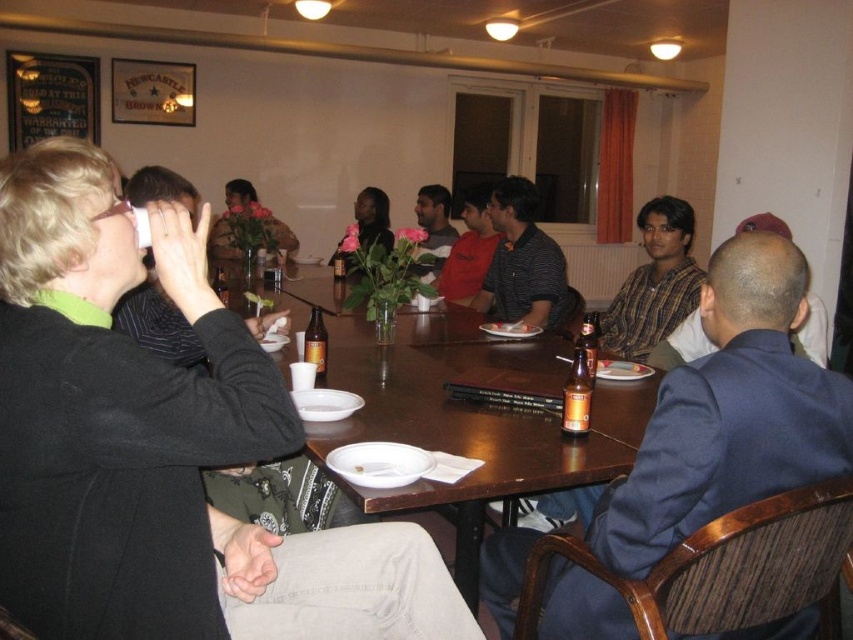
Question: From the image, what is the correct spatial relationship of dark blue suit at center in relation to matte black shirt at center?

Choices:
 (A) below
 (B) above

Answer: (A)

Question: Can you confirm if golden glass bottle at table center is wider than brown glass bottle at table center?

Choices:
 (A) no
 (B) yes

Answer: (A)

Question: Does brown wooden table at center lie behind dark blue suit at center?

Choices:
 (A) yes
 (B) no

Answer: (B)

Question: Which is nearer to the golden glass bottle at table center?

Choices:
 (A) striped polo shirt at center
 (B) red cotton shirt at center
 (C) checkered shirt at center

Answer: (C)

Question: Which of the following is the closest to the observer?

Choices:
 (A) brown glass bottle at table center
 (B) checkered shirt at center

Answer: (A)

Question: Estimate the real-world distances between objects in this image. Which object is closer to the red cotton shirt at center?

Choices:
 (A) matte black shirt at center
 (B) golden glass bottle at table center
 (C) blue suit jacket at center
 (D) brown wooden table at center

Answer: (A)